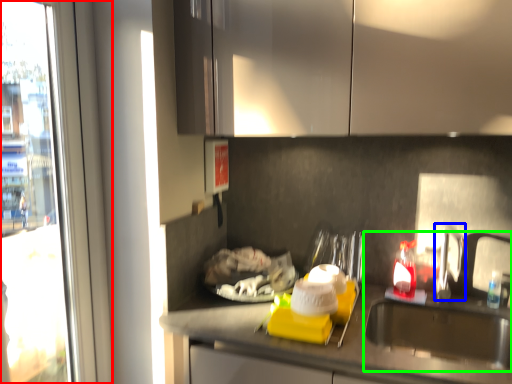
Question: Which object is positioned farthest from window (highlighted by a red box)? Select from faucet (highlighted by a blue box) and sink (highlighted by a green box).

Choices:
 (A) faucet
 (B) sink

Answer: (A)